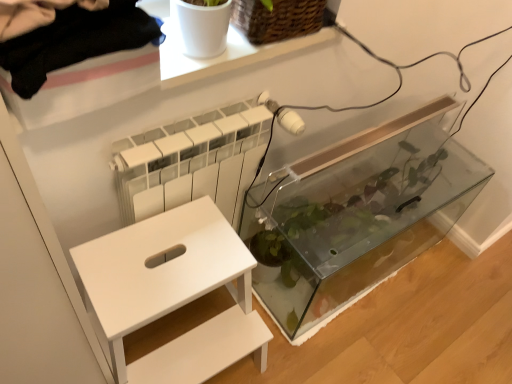
Identify the location of unoccupied area in front of transparent glass tank at center. (369, 343).